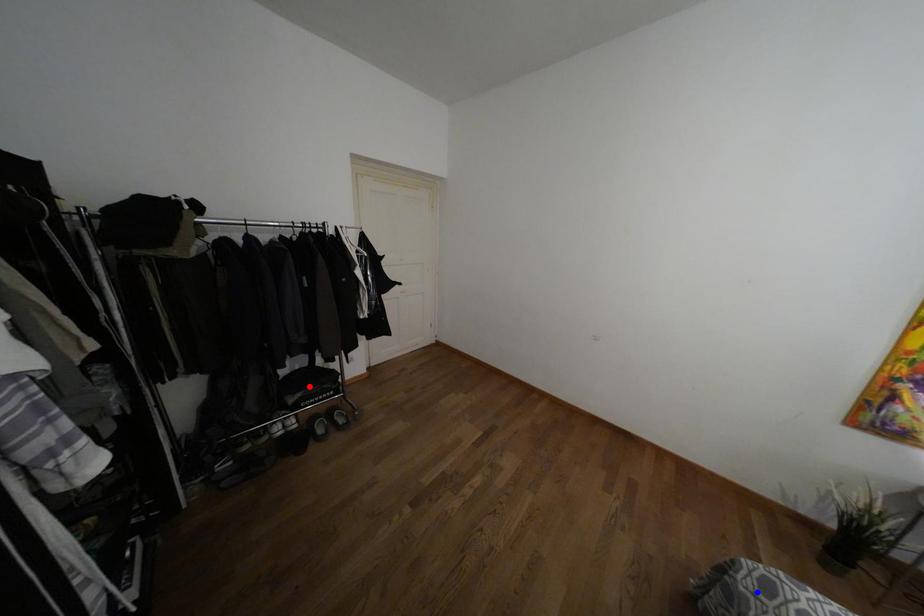
Question: Which of the two points in the image is closer to the camera?

Choices:
 (A) Blue point is closer.
 (B) Red point is closer.

Answer: (A)